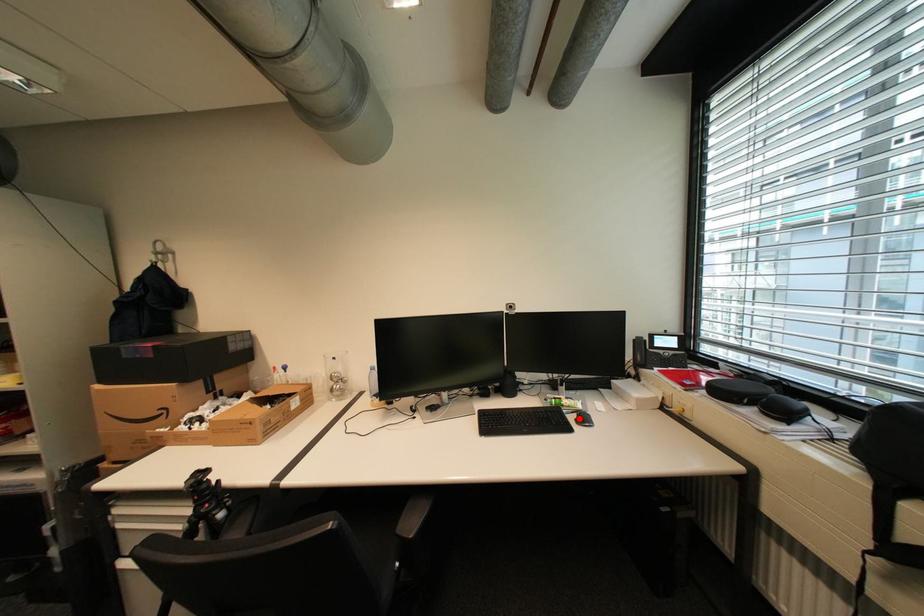
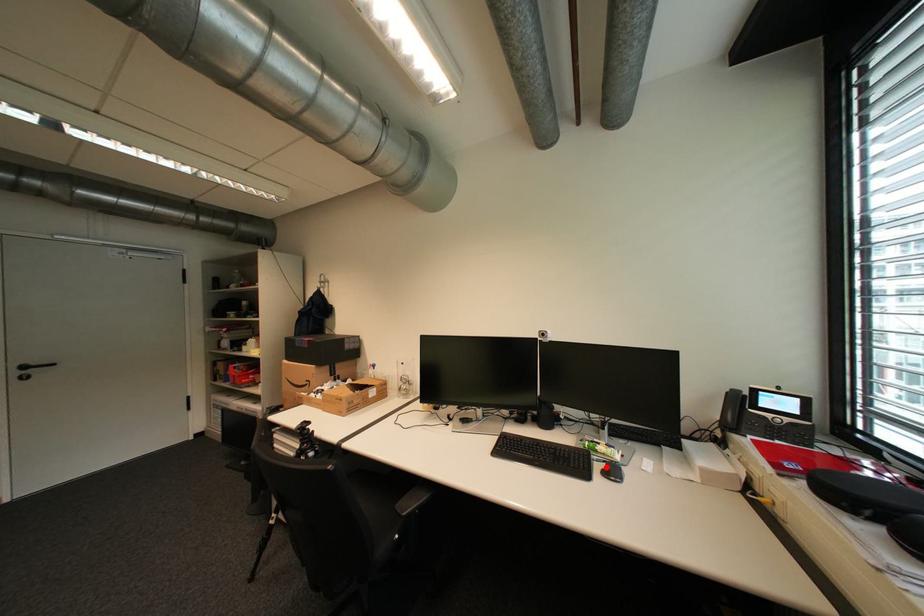
I am providing you with two images of the same scene from different viewpoints. A red point is marked on the first image and another point is marked on the second image. Are the points marked in image1 and image2 representing the same 3D position?

Yes